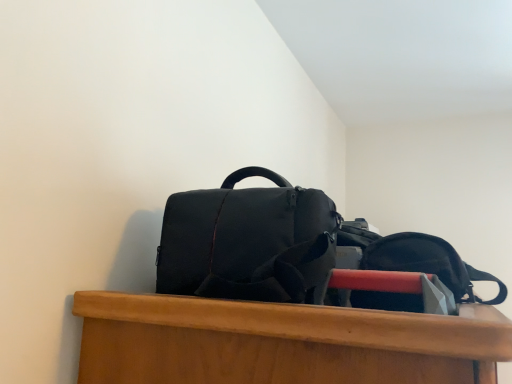
At what (x,y) coordinates should I click in order to perform the action: click on matte black duffel bag at upper center, marked as the 2th backpack in a right-to-left arrangement. Please return your answer as a coordinate pair (x, y). Looking at the image, I should click on (248, 241).

Measure the distance between point (199,288) and camera.

Point (199,288) and camera are 26.69 inches apart.

Describe the element at coordinates (248, 241) in the screenshot. The width and height of the screenshot is (512, 384). I see `matte black duffel bag at upper center, marked as the 2th backpack in a right-to-left arrangement` at that location.

What do you see at coordinates (429, 263) in the screenshot? The width and height of the screenshot is (512, 384). I see `matte black backpack at upper center, the 1th backpack positioned from the right` at bounding box center [429, 263].

In order to click on matte black backpack at upper center, marked as the second backpack in a left-to-right arrangement in this screenshot , I will do `click(429, 263)`.

Identify the location of matte black duffel bag at upper center, the 1th backpack in the left-to-right sequence. The height and width of the screenshot is (384, 512). (248, 241).

Considering the relative positions of matte black backpack at upper center, marked as the second backpack in a left-to-right arrangement, and matte black duffel bag at upper center, marked as the 2th backpack in a right-to-left arrangement, in the image provided, is matte black backpack at upper center, marked as the second backpack in a left-to-right arrangement, to the right of matte black duffel bag at upper center, marked as the 2th backpack in a right-to-left arrangement, from the viewer's perspective?

Yes.

Based on the photo, between matte black backpack at upper center, marked as the second backpack in a left-to-right arrangement, and matte black duffel bag at upper center, the 1th backpack in the left-to-right sequence, which one is positioned in front?

Positioned in front is matte black duffel bag at upper center, the 1th backpack in the left-to-right sequence.

Which is in front, point (374, 294) or point (331, 233)?

The point (331, 233) is more forward.

From the image's perspective, is matte black backpack at upper center, marked as the second backpack in a left-to-right arrangement, below matte black duffel bag at upper center, marked as the 2th backpack in a right-to-left arrangement?

Yes.

From a real-world perspective, is matte black backpack at upper center, marked as the second backpack in a left-to-right arrangement, beneath matte black duffel bag at upper center, marked as the 2th backpack in a right-to-left arrangement?

Indeed, from a real-world perspective, matte black backpack at upper center, marked as the second backpack in a left-to-right arrangement, is positioned beneath matte black duffel bag at upper center, marked as the 2th backpack in a right-to-left arrangement.

Between matte black backpack at upper center, the 1th backpack positioned from the right, and matte black duffel bag at upper center, marked as the 2th backpack in a right-to-left arrangement, which one has larger width?

With larger width is matte black duffel bag at upper center, marked as the 2th backpack in a right-to-left arrangement.

In terms of height, does matte black backpack at upper center, the 1th backpack positioned from the right, look taller or shorter compared to matte black duffel bag at upper center, marked as the 2th backpack in a right-to-left arrangement?

Clearly, matte black backpack at upper center, the 1th backpack positioned from the right, is shorter compared to matte black duffel bag at upper center, marked as the 2th backpack in a right-to-left arrangement.

Considering the sizes of objects matte black backpack at upper center, marked as the second backpack in a left-to-right arrangement, and matte black duffel bag at upper center, marked as the 2th backpack in a right-to-left arrangement, in the image provided, who is bigger, matte black backpack at upper center, marked as the second backpack in a left-to-right arrangement, or matte black duffel bag at upper center, marked as the 2th backpack in a right-to-left arrangement,?

matte black duffel bag at upper center, marked as the 2th backpack in a right-to-left arrangement.

Based on the photo, can we say matte black backpack at upper center, the 1th backpack positioned from the right, lies outside matte black duffel bag at upper center, marked as the 2th backpack in a right-to-left arrangement?

Indeed, matte black backpack at upper center, the 1th backpack positioned from the right, is completely outside matte black duffel bag at upper center, marked as the 2th backpack in a right-to-left arrangement.

Is matte black backpack at upper center, the 1th backpack positioned from the right, not near matte black duffel bag at upper center, marked as the 2th backpack in a right-to-left arrangement?

No, there isn't a large distance between matte black backpack at upper center, the 1th backpack positioned from the right, and matte black duffel bag at upper center, marked as the 2th backpack in a right-to-left arrangement.

Is matte black backpack at upper center, the 1th backpack positioned from the right, turned away from matte black duffel bag at upper center, the 1th backpack in the left-to-right sequence?

matte black backpack at upper center, the 1th backpack positioned from the right, is not turned away from matte black duffel bag at upper center, the 1th backpack in the left-to-right sequence.

Identify the location of backpack that is in front of the matte black backpack at upper center, the 1th backpack positioned from the right. (248, 241).

Based on their positions, is matte black duffel bag at upper center, marked as the 2th backpack in a right-to-left arrangement, located to the left or right of matte black backpack at upper center, the 1th backpack positioned from the right?

Clearly, matte black duffel bag at upper center, marked as the 2th backpack in a right-to-left arrangement, is on the left of matte black backpack at upper center, the 1th backpack positioned from the right, in the image.

Is matte black duffel bag at upper center, the 1th backpack in the left-to-right sequence, further to camera compared to matte black backpack at upper center, the 1th backpack positioned from the right?

No.

Between point (246, 262) and point (466, 287), which one is positioned in front?

The point (246, 262) is in front.

From the image's perspective, would you say matte black duffel bag at upper center, the 1th backpack in the left-to-right sequence, is positioned over matte black backpack at upper center, the 1th backpack positioned from the right?

Yes, from the image's perspective, matte black duffel bag at upper center, the 1th backpack in the left-to-right sequence, is on top of matte black backpack at upper center, the 1th backpack positioned from the right.

From a real-world perspective, is matte black duffel bag at upper center, marked as the 2th backpack in a right-to-left arrangement, located beneath matte black backpack at upper center, marked as the second backpack in a left-to-right arrangement?

Actually, matte black duffel bag at upper center, marked as the 2th backpack in a right-to-left arrangement, is physically above matte black backpack at upper center, marked as the second backpack in a left-to-right arrangement, in the real world.

Is matte black duffel bag at upper center, the 1th backpack in the left-to-right sequence, thinner than matte black backpack at upper center, marked as the second backpack in a left-to-right arrangement?

Incorrect, the width of matte black duffel bag at upper center, the 1th backpack in the left-to-right sequence, is not less than that of matte black backpack at upper center, marked as the second backpack in a left-to-right arrangement.

Considering the relative sizes of matte black duffel bag at upper center, the 1th backpack in the left-to-right sequence, and matte black backpack at upper center, marked as the second backpack in a left-to-right arrangement, in the image provided, is matte black duffel bag at upper center, the 1th backpack in the left-to-right sequence, shorter than matte black backpack at upper center, marked as the second backpack in a left-to-right arrangement,?

In fact, matte black duffel bag at upper center, the 1th backpack in the left-to-right sequence, may be taller than matte black backpack at upper center, marked as the second backpack in a left-to-right arrangement.

Can you confirm if matte black duffel bag at upper center, marked as the 2th backpack in a right-to-left arrangement, is smaller than matte black backpack at upper center, marked as the second backpack in a left-to-right arrangement?

Incorrect, matte black duffel bag at upper center, marked as the 2th backpack in a right-to-left arrangement, is not smaller in size than matte black backpack at upper center, marked as the second backpack in a left-to-right arrangement.

Does matte black duffel bag at upper center, marked as the 2th backpack in a right-to-left arrangement, contain matte black backpack at upper center, marked as the second backpack in a left-to-right arrangement?

No.

Is matte black duffel bag at upper center, the 1th backpack in the left-to-right sequence, not near matte black backpack at upper center, marked as the second backpack in a left-to-right arrangement?

They are positioned close to each other.

Is matte black duffel bag at upper center, the 1th backpack in the left-to-right sequence, facing away from matte black backpack at upper center, marked as the second backpack in a left-to-right arrangement?

No, matte black duffel bag at upper center, the 1th backpack in the left-to-right sequence, is not facing the opposite direction of matte black backpack at upper center, marked as the second backpack in a left-to-right arrangement.

How many degrees apart are the facing directions of matte black duffel bag at upper center, the 1th backpack in the left-to-right sequence, and matte black backpack at upper center, marked as the second backpack in a left-to-right arrangement?

The angular difference between matte black duffel bag at upper center, the 1th backpack in the left-to-right sequence, and matte black backpack at upper center, marked as the second backpack in a left-to-right arrangement, is 0.187 degrees.

The image size is (512, 384). Identify the location of backpack below the matte black duffel bag at upper center, marked as the 2th backpack in a right-to-left arrangement (from the image's perspective). (429, 263).

Locate an element on the screen. Image resolution: width=512 pixels, height=384 pixels. backpack that appears on the left of matte black backpack at upper center, marked as the second backpack in a left-to-right arrangement is located at coordinates (248, 241).

Where is `backpack below the matte black duffel bag at upper center, marked as the 2th backpack in a right-to-left arrangement (from the image's perspective)`? backpack below the matte black duffel bag at upper center, marked as the 2th backpack in a right-to-left arrangement (from the image's perspective) is located at coordinates (429, 263).